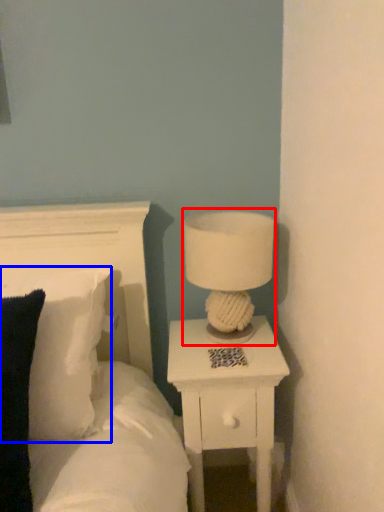
Question: Which point is further to the camera, table lamp (highlighted by a red box) or pillow (highlighted by a blue box)?

Choices:
 (A) table lamp
 (B) pillow

Answer: (A)